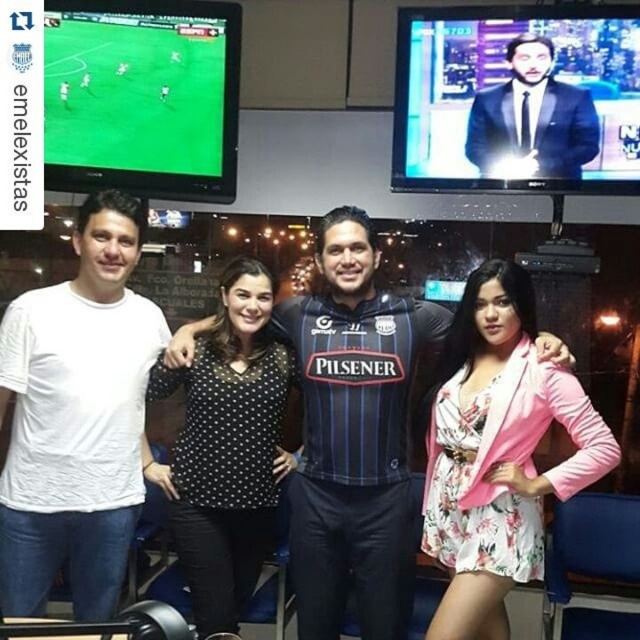
Question: Considering the relative positions of blue striped jersey at center and black dotted blouse at center in the image provided, where is blue striped jersey at center located with respect to black dotted blouse at center?

Choices:
 (A) below
 (B) above

Answer: (B)

Question: Which point is farther from the camera taking this photo?

Choices:
 (A) (362, 468)
 (B) (257, 278)
 (C) (570, 150)

Answer: (C)

Question: Does floral fabric romper at center have a smaller size compared to dark blue suit at upper right?

Choices:
 (A) no
 (B) yes

Answer: (A)

Question: Which object is farther from the camera taking this photo?

Choices:
 (A) floral fabric romper at center
 (B) dark blue suit at upper right
 (C) blue striped jersey at center
 (D) black dotted blouse at center

Answer: (B)

Question: Among these objects, which one is nearest to the camera?

Choices:
 (A) dark blue suit at upper right
 (B) blue striped jersey at center
 (C) white cotton t-shirt at left

Answer: (C)

Question: Does white cotton t-shirt at left appear over dark blue suit at upper right?

Choices:
 (A) no
 (B) yes

Answer: (A)